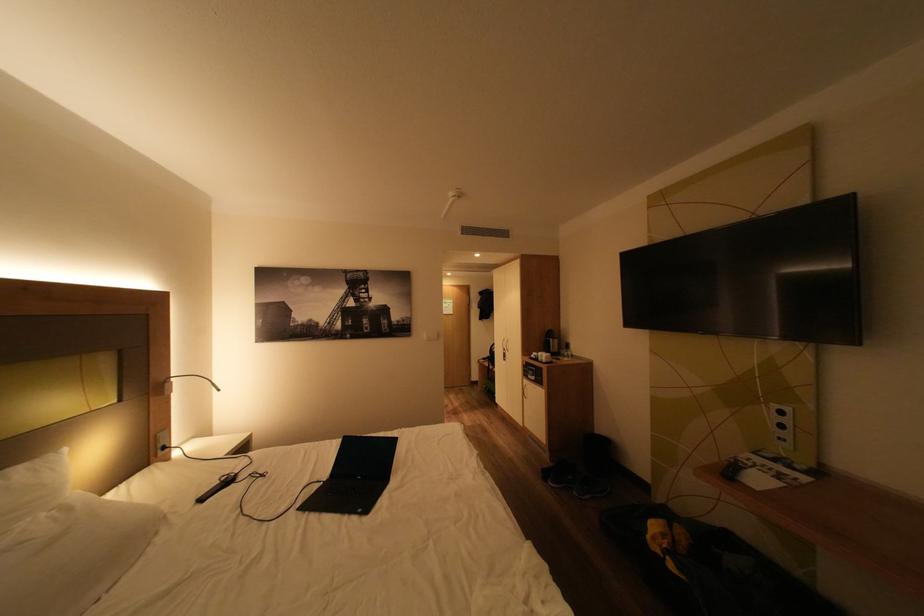
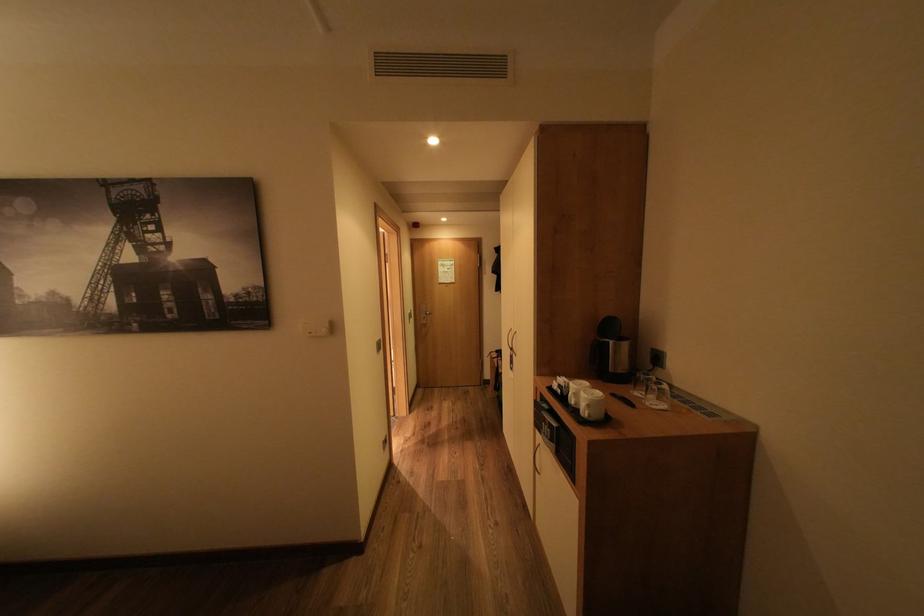
In the second image, find the point that corresponds to (x=555, y=358) in the first image.

(600, 406)